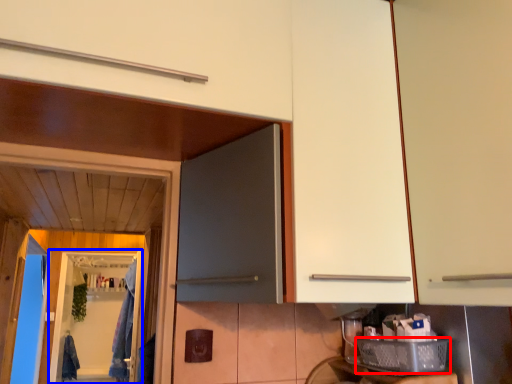
Question: Which object is closer to the camera taking this photo, basket (highlighted by a red box) or screen door (highlighted by a blue box)?

Choices:
 (A) basket
 (B) screen door

Answer: (A)